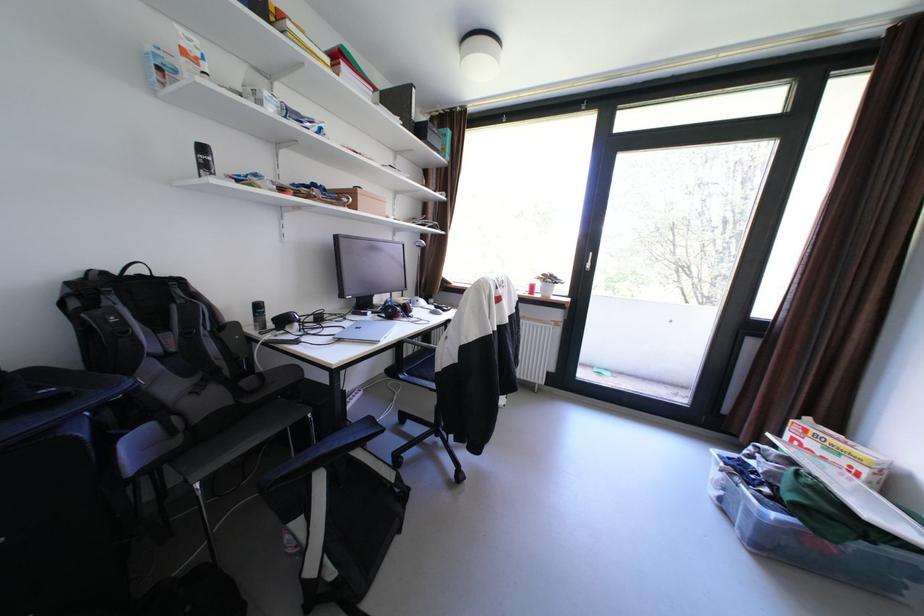
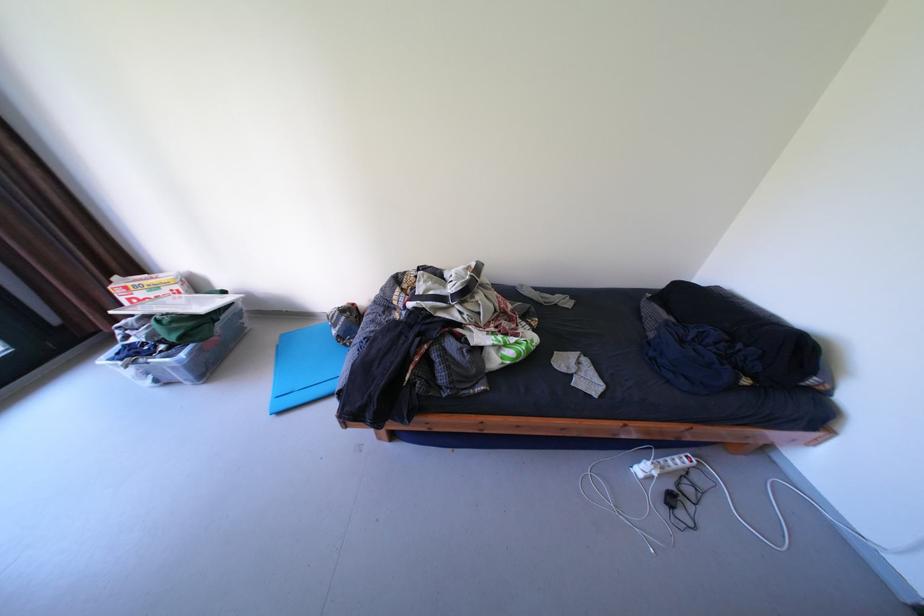
Locate, in the second image, the point that corresponds to point 874,471 in the first image.

(188, 286)